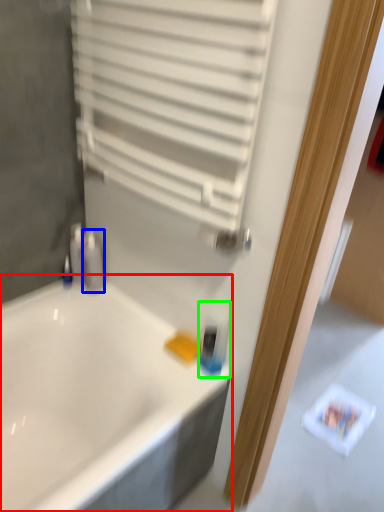
Question: Based on their relative distances, which object is nearer to bathtub (highlighted by a red box)? Choose from toiletry (highlighted by a blue box) and mouthwash (highlighted by a green box).

Choices:
 (A) toiletry
 (B) mouthwash

Answer: (B)